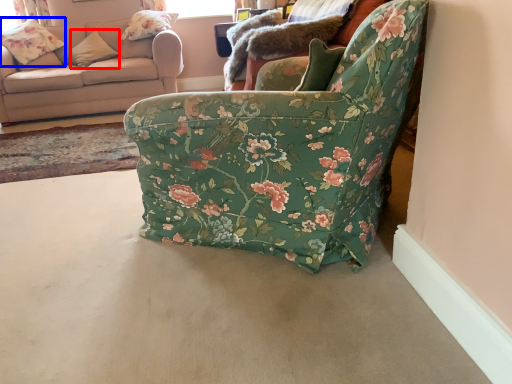
Question: Which object appears closest to the camera in this image, pillow (highlighted by a red box) or flower (highlighted by a blue box)?

Choices:
 (A) pillow
 (B) flower

Answer: (B)